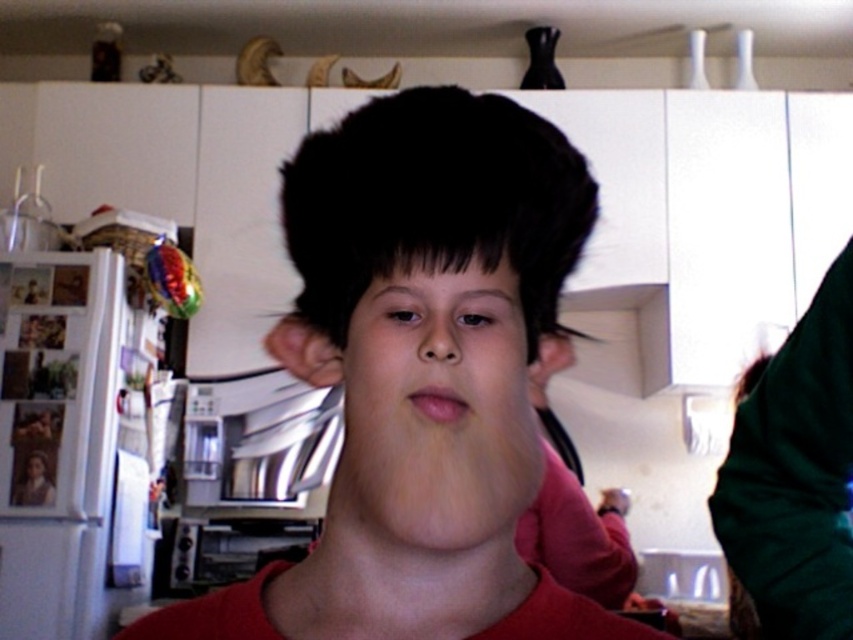
Who is shorter, smooth skin face at center or pink smooth lips at center?

pink smooth lips at center

Is smooth skin face at center below pink smooth lips at center?

Correct, smooth skin face at center is located below pink smooth lips at center.

This screenshot has height=640, width=853. Describe the element at coordinates (434, 417) in the screenshot. I see `smooth skin face at center` at that location.

This screenshot has width=853, height=640. Find the location of `smooth skin face at center`. smooth skin face at center is located at coordinates (434, 417).

Can you confirm if matte black wig at center is positioned to the right of black matte hair at center?

Correct, you'll find matte black wig at center to the right of black matte hair at center.

Which is more to the left, matte black wig at center or black matte hair at center?

black matte hair at center

Who is more forward, (271, 348) or (364, 164)?

Point (364, 164) is more forward.

Locate an element on the screen. The width and height of the screenshot is (853, 640). matte black wig at center is located at coordinates (421, 376).

Between matte skin nose at center and pink smooth lips at center, which one appears on the left side from the viewer's perspective?

matte skin nose at center is more to the left.

Between matte skin nose at center and pink smooth lips at center, which one is positioned higher?

matte skin nose at center is higher up.

Who is more forward, [456,348] or [408,392]?

Point [456,348]

I want to click on matte skin nose at center, so click(x=439, y=337).